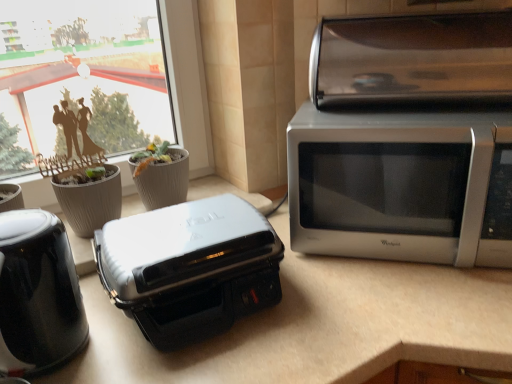
At what (x,y) coordinates should I click in order to perform the action: click on vacant area that lies in front of satin silver microwave at right. Please return your answer as a coordinate pair (x, y). This screenshot has width=512, height=384. Looking at the image, I should click on (410, 305).